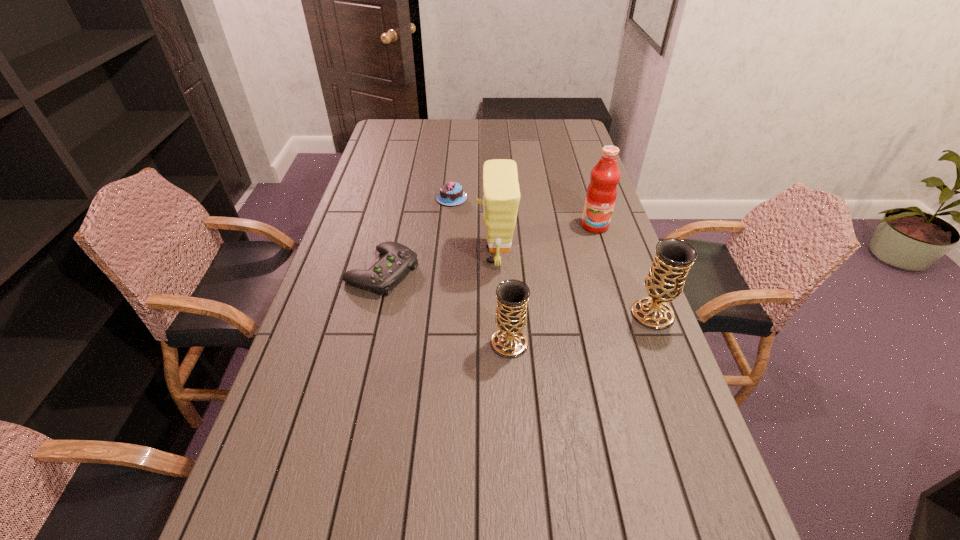
Locate an element on the screen. This screenshot has width=960, height=540. vacant area that satisfies the following two spatial constraints: 1. on the face of the left chalice; 2. on the left side of the sponge is located at coordinates (498, 343).

Identify the location of vacant area in the image that satisfies the following two spatial constraints: 1. on the front label of the fruit juice; 2. on the face of the sponge. The height and width of the screenshot is (540, 960). 604,255.